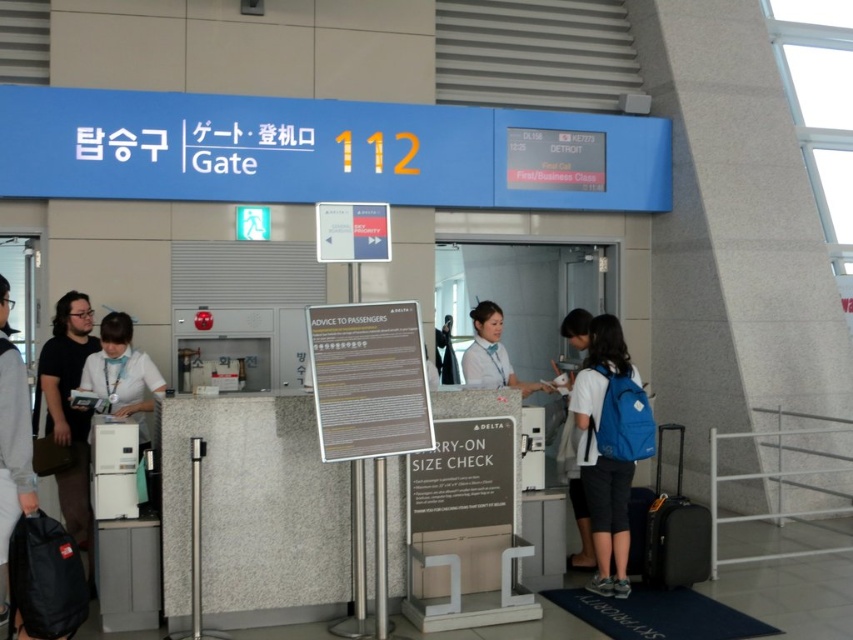
Does black fabric backpack at lower left appear on the left side of white cotton shirt at left?

Incorrect, black fabric backpack at lower left is not on the left side of white cotton shirt at left.

What do you see at coordinates (45, 579) in the screenshot? I see `black fabric backpack at lower left` at bounding box center [45, 579].

Which is behind, point (38, 536) or point (20, 486)?

The point (38, 536) is more distant.

What are the coordinates of `black fabric backpack at lower left` in the screenshot? It's located at (45, 579).

Is dark brown leather jacket at left thinner than black hardshell suitcase at lower right?

No, dark brown leather jacket at left is not thinner than black hardshell suitcase at lower right.

In the scene shown: Who is more distant from viewer, (53, 349) or (646, 561)?

The point (53, 349) is more distant.

This screenshot has height=640, width=853. I want to click on dark brown leather jacket at left, so click(x=70, y=413).

You are a GUI agent. You are given a task and a screenshot of the screen. Output one action in this format:
    pyautogui.click(x=<x>, y=<y>)
    Task: Click on the dark brown leather jacket at left
    
    Given the screenshot: What is the action you would take?
    pyautogui.click(x=70, y=413)

Who is more forward, (71,460) or (16,456)?

Point (16,456)

Does point (59, 417) lie in front of point (22, 499)?

No, (59, 417) is further to viewer.

The width and height of the screenshot is (853, 640). Identify the location of dark brown leather jacket at left. (70, 413).